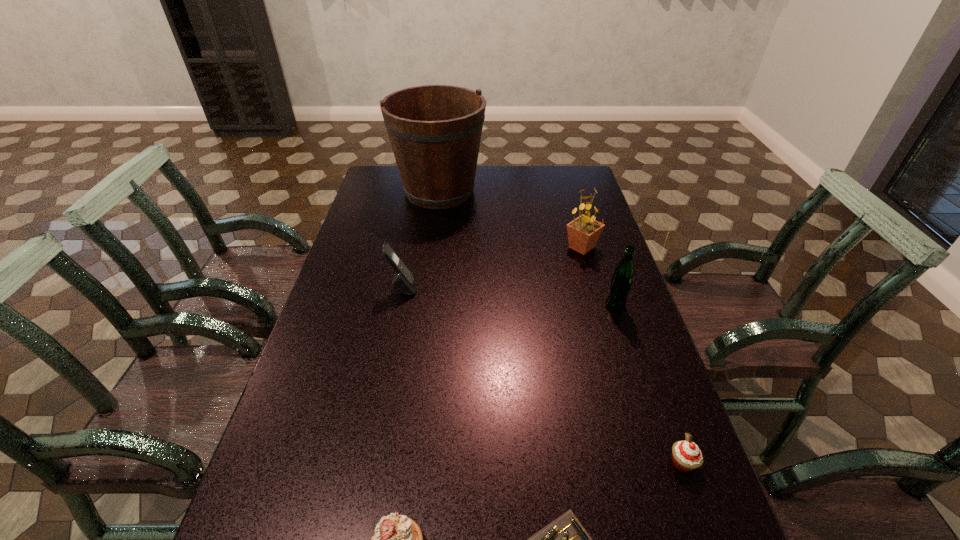
I want to click on vacant space located at the front of the sunflower with flowers visible, so click(x=483, y=247).

The image size is (960, 540). I want to click on vacant space located 0.090m at the front of the sunflower with flowers visible, so click(537, 247).

Identify the location of free location located on the left of the beer bottle. Image resolution: width=960 pixels, height=540 pixels. (488, 306).

I want to click on vacant position located 0.280m on the front-facing side of the fourth shortest object, so click(x=510, y=287).

At what (x,y) coordinates should I click in order to perform the action: click on vacant space located on the back of the fifth farthest object. Please return your answer as a coordinate pair (x, y). The width and height of the screenshot is (960, 540). Looking at the image, I should click on (648, 366).

At what (x,y) coordinates should I click in order to perform the action: click on object that is at the far edge. Please return your answer as a coordinate pair (x, y). Image resolution: width=960 pixels, height=540 pixels. Looking at the image, I should click on (435, 131).

The height and width of the screenshot is (540, 960). What are the coordinates of `object located in the left edge section of the desktop` in the screenshot? It's located at (435, 131).

I want to click on sunflower at the right edge, so click(583, 232).

Identify the location of beer bottle that is positioned at the right edge. The height and width of the screenshot is (540, 960). (621, 282).

Where is `cupcake that is at the right edge`? Image resolution: width=960 pixels, height=540 pixels. cupcake that is at the right edge is located at coordinates (687, 456).